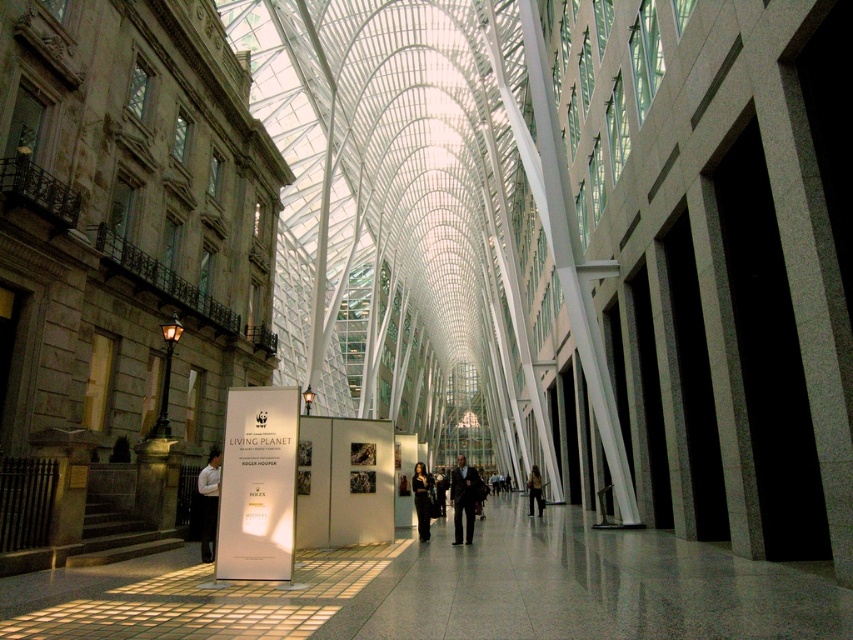
You are standing at the entrance of the atrium and see both the dark suit at center and the black fabric dress at center. Which one is farther away from you?

The dark suit at center is 5.20 meters away from the black fabric dress at center, so whichever one is closer to you, the other would be farther. However, since both are at center, they are equidistant from the entrance. Therefore, neither is farther away.

You are attending a formal event and see two outfits displayed in an atrium with modern columns and a glass roof. The outfits are the dark suit at center and the black fabric dress at center. Which outfit is positioned lower in the atrium?

The dark suit at center is located below the black fabric dress at center, so the dark suit at center is positioned lower in the atrium.

You are standing in the atrium and notice two garments hanging on a rack between the classical building and the modern columns. Which garment is closer to you, the white shirt at center or the black fabric dress at center?

The white shirt at center is closer to you because it is in front of the black fabric dress at center.